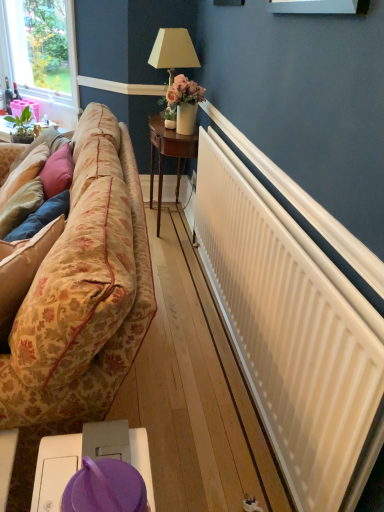
Describe the element at coordinates (5, 42) in the screenshot. The width and height of the screenshot is (384, 512). I see `clear glass window at upper left` at that location.

In order to face wooden side table at center, which is counted as the 2th table, starting from the back, should I rotate leftwards or rightwards?

To face it directly, rotate left by 3.074 degrees.

Where is `clear glass window at upper left`? This screenshot has width=384, height=512. clear glass window at upper left is located at coordinates (5, 42).

Is matte pink plastic at left, the 1th table when ordered from top to bottom, completely or partially outside of clear glass window at upper left?

That's correct, matte pink plastic at left, the 1th table when ordered from top to bottom, is outside of clear glass window at upper left.

Is matte pink plastic at left, the first table in the left-to-right sequence, positioned behind clear glass window at upper left?

No, matte pink plastic at left, the first table in the left-to-right sequence, is closer to the camera.

Starting from the clear glass window at upper left, which table is the 1st one to the right? Please provide its 2D coordinates.

[(5, 129)]

Between point (0, 64) and point (355, 442), which one is positioned behind?

Point (0, 64)

Which object is closer to the camera, clear glass window at upper left or white matte radiator at right?

white matte radiator at right is more forward.

The image size is (384, 512). In the image, there is a white matte radiator at right. Identify the location of window above it (from the image's perspective). (5, 42).

How many degrees apart are the facing directions of beige fabric lampshade at upper center and floral fabric couch at left?

0.321 degrees.

Can floral fabric couch at left be found inside beige fabric lampshade at upper center?

No, floral fabric couch at left is not inside beige fabric lampshade at upper center.

Which is behind, point (181, 75) or point (44, 398)?

The point (181, 75) is behind.

Is beige fabric lampshade at upper center far from floral fabric couch at left?

Yes, beige fabric lampshade at upper center and floral fabric couch at left are quite far apart.

Between purple fabric at lower center, placed as the first table when sorted from right to left, and floral fabric couch at left, which one has smaller size?

purple fabric at lower center, placed as the first table when sorted from right to left.

Would you consider purple fabric at lower center, positioned as the 3th table in left-to-right order, to be distant from floral fabric couch at left?

No.

Considering the relative sizes of purple fabric at lower center, positioned as the 3th table in back-to-front order, and floral fabric couch at left in the image provided, is purple fabric at lower center, positioned as the 3th table in back-to-front order, wider than floral fabric couch at left?

In fact, purple fabric at lower center, positioned as the 3th table in back-to-front order, might be narrower than floral fabric couch at left.

Can we say purple fabric at lower center, placed as the first table when sorted from right to left, lies outside floral fabric couch at left?

purple fabric at lower center, placed as the first table when sorted from right to left, is positioned outside floral fabric couch at left.

Does white matte radiator at right have a greater width compared to floral fabric couch at left?

Incorrect, the width of white matte radiator at right does not surpass that of floral fabric couch at left.

Can you confirm if white matte radiator at right is bigger than floral fabric couch at left?

No.

Considering the positions of point (210, 180) and point (25, 415), is point (210, 180) closer or farther from the camera than point (25, 415)?

Clearly, point (210, 180) is more distant from the camera than point (25, 415).

Between white matte radiator at right and floral fabric couch at left, which one appears on the left side from the viewer's perspective?

From the viewer's perspective, floral fabric couch at left appears more on the left side.

Can clear glass window at upper left be found inside purple fabric at lower center, positioned as the 3th table in back-to-front order?

Definitely not — clear glass window at upper left is not inside purple fabric at lower center, positioned as the 3th table in back-to-front order.

In the scene shown: Can you confirm if purple fabric at lower center, marked as the first table in a bottom-to-top arrangement, is shorter than clear glass window at upper left?

Yes.

From a real-world perspective, does purple fabric at lower center, positioned as the 3th table in back-to-front order, stand above clear glass window at upper left?

No, from a real-world perspective, purple fabric at lower center, positioned as the 3th table in back-to-front order, is not above clear glass window at upper left.

Does purple fabric at lower center, the first table positioned from the front, appear on the left side of clear glass window at upper left?

In fact, purple fabric at lower center, the first table positioned from the front, is to the right of clear glass window at upper left.

Can you confirm if wooden side table at center, which is counted as the 2th table, starting from the back, is thinner than matte pink plastic at left, the 1th table when ordered from top to bottom?

In fact, wooden side table at center, which is counted as the 2th table, starting from the back, might be wider than matte pink plastic at left, the 1th table when ordered from top to bottom.

Who is more distant, wooden side table at center, arranged as the 2th table when viewed from the front, or matte pink plastic at left, placed as the third table when sorted from front to back?

matte pink plastic at left, placed as the third table when sorted from front to back, is more distant.

Is wooden side table at center, the second table in the top-to-bottom sequence, surrounding matte pink plastic at left, placed as the third table when sorted from front to back?

No, matte pink plastic at left, placed as the third table when sorted from front to back, is not a part of wooden side table at center, the second table in the top-to-bottom sequence.

Does wooden side table at center, the second table in the top-to-bottom sequence, have a greater height compared to matte pink plastic at left, the first table in the left-to-right sequence?

Yes, wooden side table at center, the second table in the top-to-bottom sequence, is taller than matte pink plastic at left, the first table in the left-to-right sequence.

Locate an element on the screen. The width and height of the screenshot is (384, 512). window located above the matte pink plastic at left, placed as the 3th table when sorted from right to left (from a real-world perspective) is located at coordinates (5, 42).

Where is `radiator directly beneath the clear glass window at upper left (from a real-world perspective)`? This screenshot has height=512, width=384. radiator directly beneath the clear glass window at upper left (from a real-world perspective) is located at coordinates (288, 335).

Based on their spatial positions, is purple fabric at lower center, placed as the first table when sorted from right to left, or floral fabric couch at left further from wooden side table at center, the second table in the top-to-bottom sequence?

purple fabric at lower center, placed as the first table when sorted from right to left.

Looking at the image, which one is located further to wooden side table at center, which is the second table from bottom to top, beige fabric lampshade at upper center or floral fabric couch at left?

floral fabric couch at left is further to wooden side table at center, which is the second table from bottom to top.

Based on their spatial positions, is purple fabric at lower center, positioned as the 3th table in left-to-right order, or floral fabric couch at left further from beige fabric lampshade at upper center?

The object further to beige fabric lampshade at upper center is purple fabric at lower center, positioned as the 3th table in left-to-right order.

Which object lies further to the anchor point clear glass window at upper left, floral fabric couch at left or purple fabric at lower center, the 3th table positioned from the top?

purple fabric at lower center, the 3th table positioned from the top, lies further to clear glass window at upper left than the other object.

Estimate the real-world distances between objects in this image. Which object is further from beige fabric lampshade at upper center, clear glass window at upper left or wooden side table at center, which is the second table from bottom to top?

clear glass window at upper left is further to beige fabric lampshade at upper center.

Consider the image. When comparing their distances from white matte radiator at right, does purple fabric at lower center, the 3th table positioned from the top, or beige fabric lampshade at upper center seem further?

beige fabric lampshade at upper center is positioned further to the anchor white matte radiator at right.

Based on the photo, from the image, which object appears to be farther from matte pink plastic at left, placed as the 3th table when sorted from right to left, floral fabric couch at left or white matte radiator at right?

Based on the image, white matte radiator at right appears to be further to matte pink plastic at left, placed as the 3th table when sorted from right to left.

Considering their positions, is matte pink plastic at left, which is counted as the 3th table, starting from the bottom, positioned further to floral fabric couch at left than purple fabric at lower center, positioned as the 3th table in left-to-right order?

matte pink plastic at left, which is counted as the 3th table, starting from the bottom, is further to floral fabric couch at left.

You are a GUI agent. You are given a task and a screenshot of the screen. Output one action in this format:
    pyautogui.click(x=<x>, y=<y>)
    Task: Click on the table between floral fabric couch at left and matte pink plastic at left, positioned as the 1th table in back-to-front order, from front to back
    
    Given the screenshot: What is the action you would take?
    pyautogui.click(x=168, y=156)

Locate an element on the screen. The image size is (384, 512). table between clear glass window at upper left and wooden side table at center, which is counted as the second table, starting from the right, in the horizontal direction is located at coordinates (5, 129).

Locate an element on the screen. The height and width of the screenshot is (512, 384). studio couch positioned between purple fabric at lower center, positioned as the 3th table in left-to-right order, and clear glass window at upper left from near to far is located at coordinates (84, 290).

The width and height of the screenshot is (384, 512). I want to click on table lamp between floral fabric couch at left and clear glass window at upper left from front to back, so click(x=179, y=75).